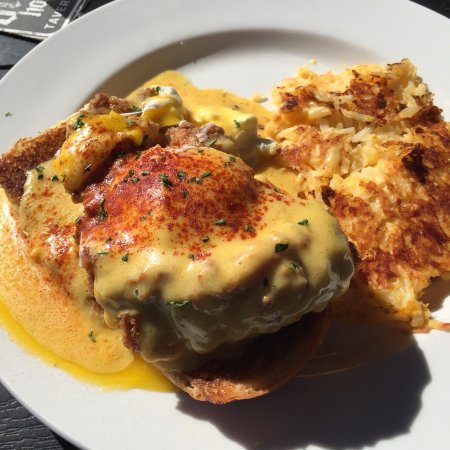
This screenshot has height=450, width=450. In order to click on crumb in this screenshot , I will do click(x=9, y=114).